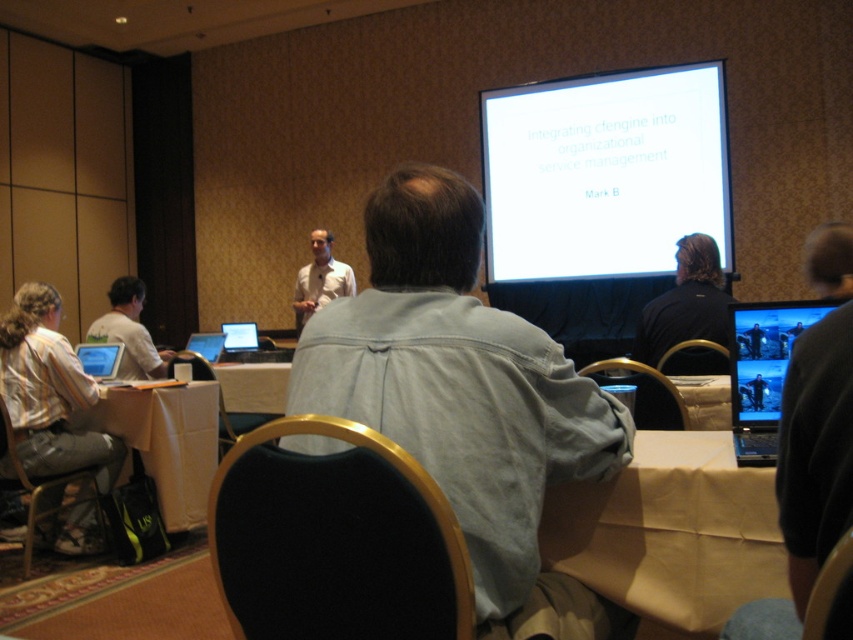
Question: Which of the following is the farthest from the observer?

Choices:
 (A) light blue denim shirt at center
 (B) matte silver laptop at center
 (C) matte black screen at upper right
 (D) brown paper bag at lower right

Answer: (B)

Question: Which point is closer to the camera?

Choices:
 (A) (218, 353)
 (B) (219, 401)
 (C) (721, 540)

Answer: (C)

Question: Where is light blue denim shirt at center located in relation to matte black screen at upper right in the image?

Choices:
 (A) above
 (B) below

Answer: (B)

Question: Is light blue denim shirt at center bigger than dark brown hair at upper right?

Choices:
 (A) yes
 (B) no

Answer: (A)

Question: Which object is closer to the camera taking this photo?

Choices:
 (A) matte black screen at upper right
 (B) brown paper bag at lower right

Answer: (B)

Question: Is white shirt at center in front of matte silver laptop at center?

Choices:
 (A) no
 (B) yes

Answer: (A)